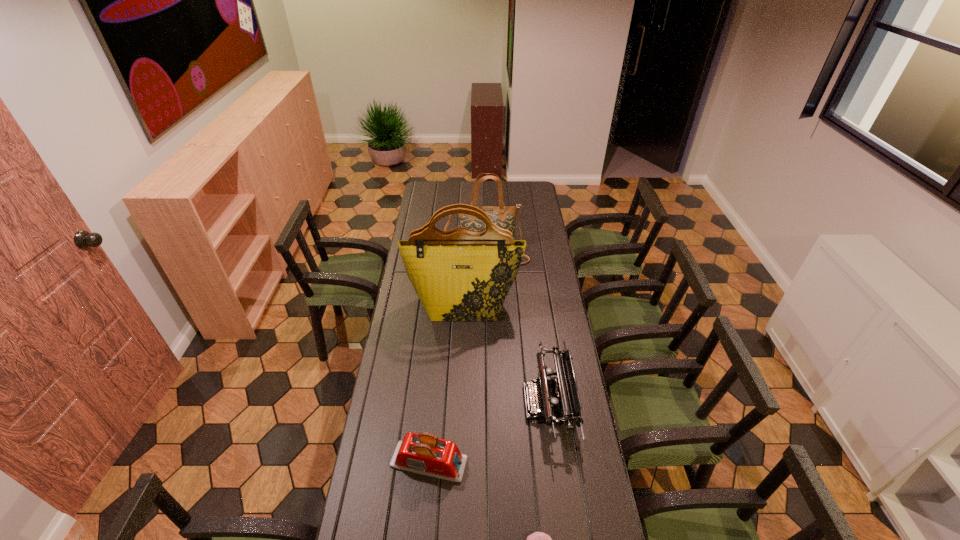
In order to click on the tallest object in this screenshot , I will do `click(459, 275)`.

Image resolution: width=960 pixels, height=540 pixels. Find the location of `the second farthest object`. the second farthest object is located at coordinates (459, 275).

The height and width of the screenshot is (540, 960). Identify the location of the farthest object. (503, 216).

At what (x,y) coordinates should I click in order to perform the action: click on handbag. Please return your answer as a coordinate pair (x, y). Looking at the image, I should click on (503, 216).

This screenshot has width=960, height=540. Find the location of `typewriter`. typewriter is located at coordinates (567, 406).

At what (x,y) coordinates should I click in order to perform the action: click on toaster. Please return your answer as a coordinate pair (x, y). This screenshot has width=960, height=540. Looking at the image, I should click on (424, 453).

Where is `vacant space located on the front-facing side of the tallest object`? vacant space located on the front-facing side of the tallest object is located at coordinates (463, 339).

Where is `vacant position located on the front-facing side of the handbag`? This screenshot has height=540, width=960. vacant position located on the front-facing side of the handbag is located at coordinates [488, 317].

Identify the location of vacant region located 0.050m on the typing side of the typewriter. (511, 402).

Where is `vacant space positioned 0.210m on the typing side of the typewriter`? The width and height of the screenshot is (960, 540). vacant space positioned 0.210m on the typing side of the typewriter is located at coordinates (468, 402).